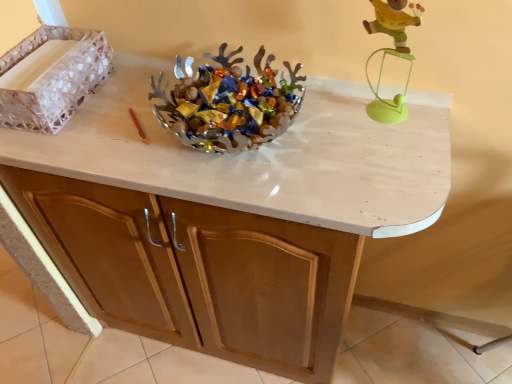
Question: Is wooden figure at upper right far away from matte wood cabinet at center?

Choices:
 (A) no
 (B) yes

Answer: (A)

Question: Is wooden figure at upper right positioned with its back to matte wood cabinet at center?

Choices:
 (A) no
 (B) yes

Answer: (A)

Question: From the image's perspective, is wooden figure at upper right over matte wood cabinet at center?

Choices:
 (A) yes
 (B) no

Answer: (A)

Question: From a real-world perspective, is wooden figure at upper right below matte wood cabinet at center?

Choices:
 (A) yes
 (B) no

Answer: (B)

Question: Does wooden figure at upper right have a lesser height compared to matte wood cabinet at center?

Choices:
 (A) yes
 (B) no

Answer: (A)

Question: Is point (135, 279) positioned closer to the camera than point (375, 102)?

Choices:
 (A) closer
 (B) farther

Answer: (B)

Question: From a real-world perspective, is matte wood cabinet at center positioned above or below wooden figure at upper right?

Choices:
 (A) below
 (B) above

Answer: (A)

Question: Is matte wood cabinet at center inside or outside of wooden figure at upper right?

Choices:
 (A) inside
 (B) outside

Answer: (B)

Question: Considering their positions, is matte wood cabinet at center located in front of or behind wooden figure at upper right?

Choices:
 (A) behind
 (B) front

Answer: (B)

Question: Visually, is metallic silver bowl at center positioned to the left or to the right of white textured tray at left?

Choices:
 (A) left
 (B) right

Answer: (B)

Question: Considering the positions of metallic silver bowl at center and white textured tray at left in the image, is metallic silver bowl at center wider or thinner than white textured tray at left?

Choices:
 (A) thin
 (B) wide

Answer: (B)

Question: In terms of size, does metallic silver bowl at center appear bigger or smaller than white textured tray at left?

Choices:
 (A) big
 (B) small

Answer: (A)

Question: In terms of height, does metallic silver bowl at center look taller or shorter compared to white textured tray at left?

Choices:
 (A) short
 (B) tall

Answer: (A)

Question: Do you think metallic silver bowl at center is within wooden figure at upper right, or outside of it?

Choices:
 (A) outside
 (B) inside

Answer: (A)

Question: Is metallic silver bowl at center in front of or behind wooden figure at upper right in the image?

Choices:
 (A) behind
 (B) front

Answer: (A)